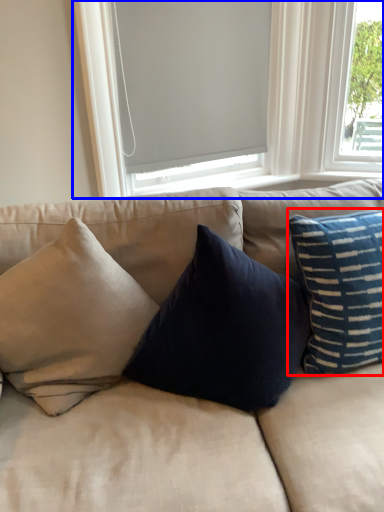
Question: Which object is further to the camera taking this photo, pillow (highlighted by a red box) or window (highlighted by a blue box)?

Choices:
 (A) pillow
 (B) window

Answer: (B)